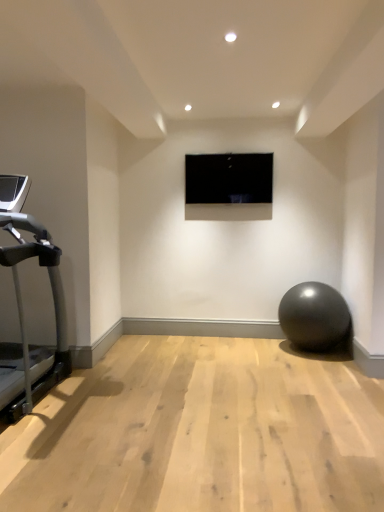
Question: Is matte gray ball at lower right in front of or behind black glossy screen at center in the image?

Choices:
 (A) front
 (B) behind

Answer: (A)

Question: Looking at the image, does matte gray ball at lower right seem bigger or smaller compared to black glossy screen at center?

Choices:
 (A) small
 (B) big

Answer: (B)

Question: Based on their relative distances, which object is nearer to the matte gray ball at lower right?

Choices:
 (A) black glossy screen at center
 (B) silver metallic treadmill at left

Answer: (A)

Question: Which object is positioned farthest from the black glossy screen at center?

Choices:
 (A) silver metallic treadmill at left
 (B) matte gray ball at lower right

Answer: (A)